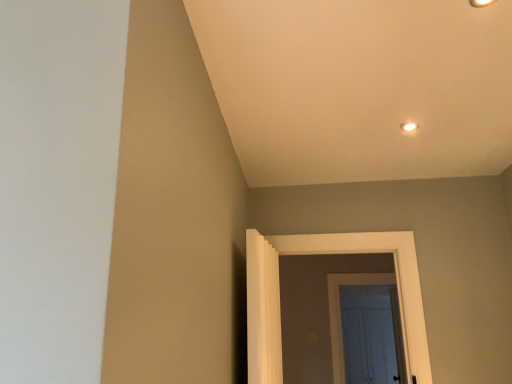
Question: From the image's perspective, is matte gold light fixture at upper right, the 1th light fixture viewed from the front, over white painted wood door at center, arranged as the first door when viewed from the front?

Choices:
 (A) yes
 (B) no

Answer: (A)

Question: Does matte gold light fixture at upper right, marked as the first light fixture in a top-to-bottom arrangement, appear on the right side of white painted wood door at center, which ranks as the 1th door in left-to-right order?

Choices:
 (A) no
 (B) yes

Answer: (B)

Question: Can you see matte gold light fixture at upper right, the second light fixture viewed from the back, touching white painted wood door at center, arranged as the first door when viewed from the front?

Choices:
 (A) no
 (B) yes

Answer: (A)

Question: From a real-world perspective, is matte gold light fixture at upper right, the second light fixture viewed from the back, over white painted wood door at center, which is counted as the second door, starting from the back?

Choices:
 (A) no
 (B) yes

Answer: (B)

Question: Is the position of matte gold light fixture at upper right, marked as the first light fixture in a top-to-bottom arrangement, less distant than that of white painted wood door at center, arranged as the first door when viewed from the front?

Choices:
 (A) no
 (B) yes

Answer: (B)

Question: Considering the positions of white painted wood door at center, which ranks as the 1th door in left-to-right order, and white wooden door at center, marked as the 1th door in a back-to-front arrangement, in the image, is white painted wood door at center, which ranks as the 1th door in left-to-right order, taller or shorter than white wooden door at center, marked as the 1th door in a back-to-front arrangement,?

Choices:
 (A) tall
 (B) short

Answer: (B)

Question: In the image, is white painted wood door at center, which is the 2th door in right-to-left order, on the left side or the right side of white wooden door at center, the 2th door from the front?

Choices:
 (A) left
 (B) right

Answer: (A)

Question: Does point (279, 241) appear closer or farther from the camera than point (333, 342)?

Choices:
 (A) farther
 (B) closer

Answer: (B)

Question: In terms of width, does white painted wood door at center, which is the 2th door in right-to-left order, look wider or thinner when compared to white wooden door at center, positioned as the 1th door in right-to-left order?

Choices:
 (A) thin
 (B) wide

Answer: (A)

Question: From their relative heights in the image, would you say white glossy light fixture at upper center, placed as the 2th light fixture when sorted from front to back, is taller or shorter than matte gold light fixture at upper right, which is counted as the second light fixture, starting from the bottom?

Choices:
 (A) tall
 (B) short

Answer: (B)

Question: In the image, is white glossy light fixture at upper center, which ranks as the first light fixture in bottom-to-top order, positioned in front of or behind matte gold light fixture at upper right, the 1th light fixture viewed from the front?

Choices:
 (A) behind
 (B) front

Answer: (A)

Question: Considering the positions of white glossy light fixture at upper center, placed as the 2th light fixture when sorted from front to back, and matte gold light fixture at upper right, the 1th light fixture viewed from the front, in the image, is white glossy light fixture at upper center, placed as the 2th light fixture when sorted from front to back, wider or thinner than matte gold light fixture at upper right, the 1th light fixture viewed from the front,?

Choices:
 (A) thin
 (B) wide

Answer: (B)

Question: Is white glossy light fixture at upper center, which ranks as the first light fixture in bottom-to-top order, to the left or to the right of matte gold light fixture at upper right, marked as the first light fixture in a top-to-bottom arrangement, in the image?

Choices:
 (A) left
 (B) right

Answer: (B)

Question: From a real-world perspective, is white wooden door at center, the 2th door from the front, above or below white painted wood door at center, which ranks as the 1th door in left-to-right order?

Choices:
 (A) below
 (B) above

Answer: (A)

Question: From the image's perspective, is white wooden door at center, the 2th door from the front, located above or below white painted wood door at center, which ranks as the 1th door in left-to-right order?

Choices:
 (A) below
 (B) above

Answer: (A)